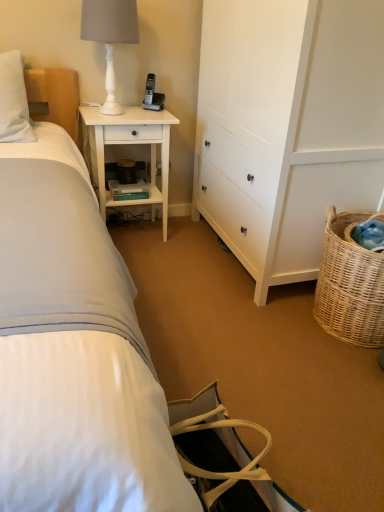
Question: From the image's perspective, does white wood nightstand at upper left appear higher than black plastic phone at upper center?

Choices:
 (A) yes
 (B) no

Answer: (B)

Question: Considering the relative sizes of white wood nightstand at upper left and black plastic phone at upper center in the image provided, is white wood nightstand at upper left shorter than black plastic phone at upper center?

Choices:
 (A) yes
 (B) no

Answer: (B)

Question: Considering the relative sizes of white wood nightstand at upper left and black plastic phone at upper center in the image provided, is white wood nightstand at upper left taller than black plastic phone at upper center?

Choices:
 (A) no
 (B) yes

Answer: (B)

Question: Could you tell me if white wood nightstand at upper left is facing black plastic phone at upper center?

Choices:
 (A) no
 (B) yes

Answer: (A)

Question: Does white wood nightstand at upper left appear on the right side of black plastic phone at upper center?

Choices:
 (A) yes
 (B) no

Answer: (B)

Question: Is black plastic phone at upper center taller or shorter than white matte table lamp at upper left?

Choices:
 (A) short
 (B) tall

Answer: (A)

Question: Is black plastic phone at upper center to the left or to the right of white matte table lamp at upper left in the image?

Choices:
 (A) left
 (B) right

Answer: (B)

Question: From the image's perspective, is black plastic phone at upper center above or below white matte table lamp at upper left?

Choices:
 (A) above
 (B) below

Answer: (B)

Question: Considering their positions, is black plastic phone at upper center located in front of or behind white matte table lamp at upper left?

Choices:
 (A) front
 (B) behind

Answer: (B)

Question: Is black plastic phone at upper center situated inside white wood nightstand at upper left or outside?

Choices:
 (A) outside
 (B) inside

Answer: (A)

Question: In terms of width, does black plastic phone at upper center look wider or thinner when compared to white wood nightstand at upper left?

Choices:
 (A) wide
 (B) thin

Answer: (B)

Question: From a real-world perspective, is black plastic phone at upper center physically located above or below white wood nightstand at upper left?

Choices:
 (A) above
 (B) below

Answer: (A)

Question: Looking at the image, does black plastic phone at upper center seem bigger or smaller compared to white wood nightstand at upper left?

Choices:
 (A) big
 (B) small

Answer: (B)

Question: From a real-world perspective, is white wood cabinet at center right physically located above or below white matte table lamp at upper left?

Choices:
 (A) below
 (B) above

Answer: (A)

Question: In the image, is white wood cabinet at center right positioned in front of or behind white matte table lamp at upper left?

Choices:
 (A) front
 (B) behind

Answer: (A)